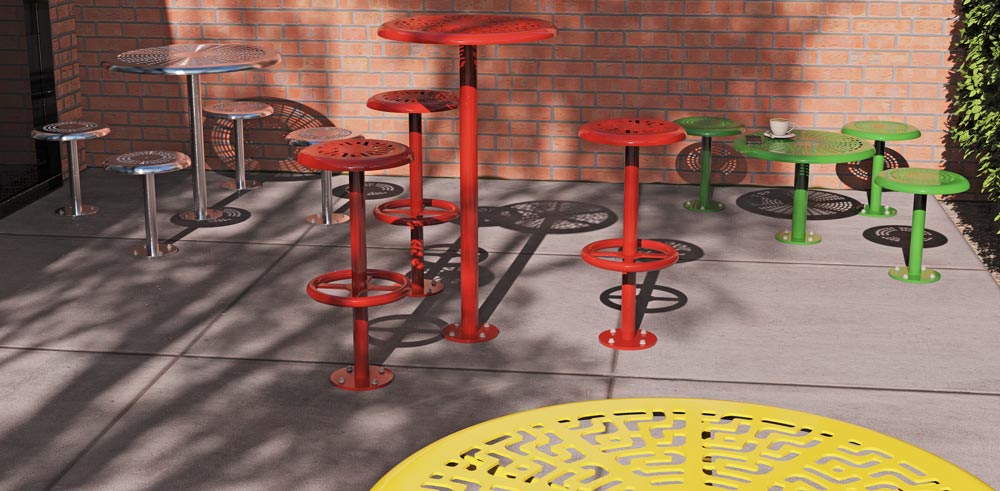
Identify the location of chrome table. (197, 45).